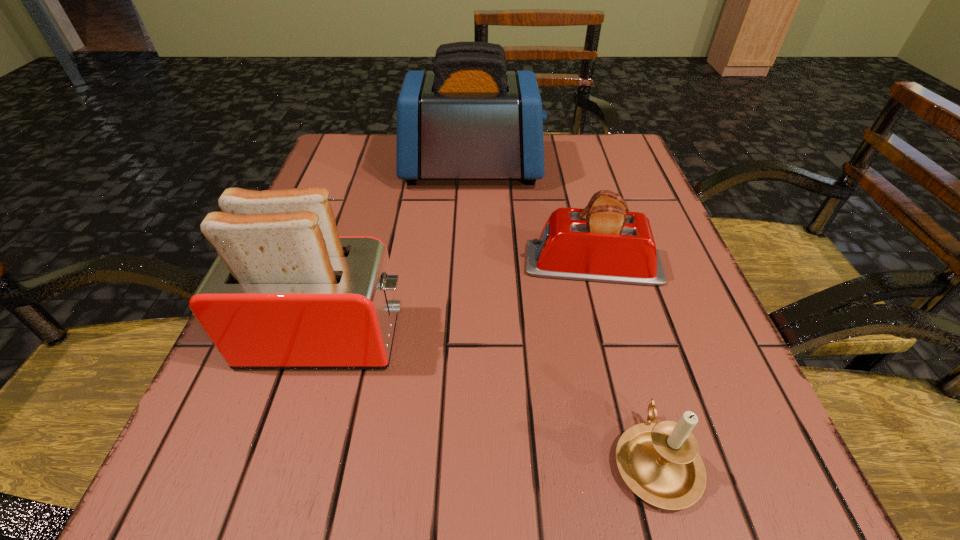
Locate an element on the screen. The width and height of the screenshot is (960, 540). the farthest object is located at coordinates (469, 118).

This screenshot has width=960, height=540. I want to click on the nearest toaster, so click(285, 291).

Where is `the second farthest toaster`? The image size is (960, 540). the second farthest toaster is located at coordinates (603, 242).

I want to click on the shortest toaster, so click(603, 242).

Where is `the nearest object`? Image resolution: width=960 pixels, height=540 pixels. the nearest object is located at coordinates (660, 463).

The height and width of the screenshot is (540, 960). I want to click on vacant region located 0.130m on the front-facing side of the farthest object, so click(595, 169).

What are the coordinates of `free location located 0.400m on the front-facing side of the second nearest object` in the screenshot? It's located at (664, 338).

Where is `free space located 0.150m on the left of the third nearest object`? The width and height of the screenshot is (960, 540). free space located 0.150m on the left of the third nearest object is located at coordinates (443, 264).

Find the location of a particular element. This screenshot has height=540, width=960. vacant space located 0.160m with a handle on the side of the candle holder is located at coordinates (616, 322).

This screenshot has width=960, height=540. Identify the location of vacant space located 0.380m with a handle on the side of the candle holder. (592, 234).